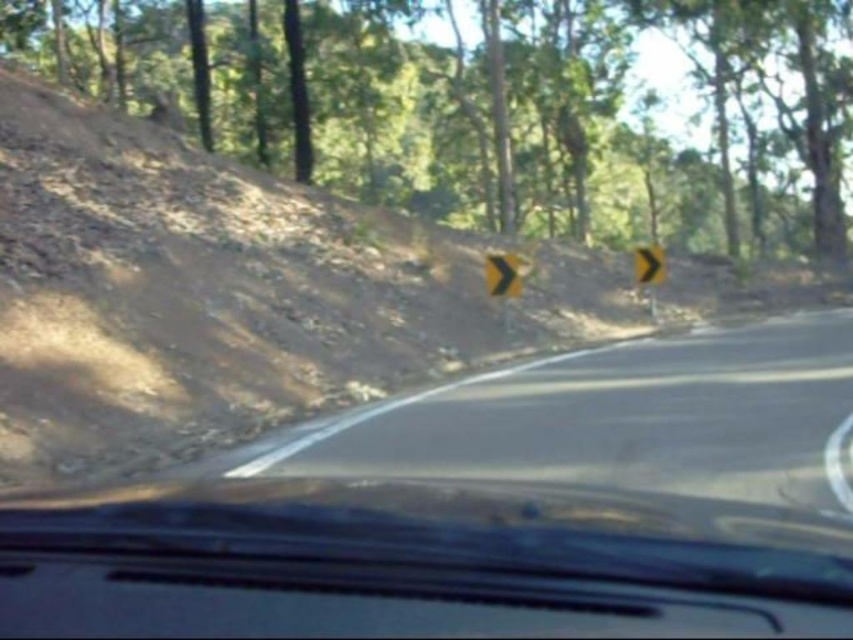
Question: Which of the following is the closest to the observer?

Choices:
 (A) black asphalt road at center
 (B) transparent plastic windshield at center
 (C) yellow matte arrow at center

Answer: (B)

Question: Observing the image, what is the correct spatial positioning of transparent plastic windshield at center in reference to yellow matte arrow at upper right?

Choices:
 (A) left
 (B) right

Answer: (A)

Question: Estimate the real-world distances between objects in this image. Which object is closer to the yellow matte arrow at upper right?

Choices:
 (A) yellow matte arrow at center
 (B) brown dirt hill at upper left
 (C) transparent plastic windshield at center
 (D) black asphalt road at center

Answer: (A)

Question: Which of the following is the closest to the observer?

Choices:
 (A) yellow matte arrow at upper right
 (B) black asphalt road at center
 (C) brown dirt hill at upper left
 (D) yellow matte arrow at center

Answer: (B)

Question: Is black asphalt road at center positioned at the back of yellow matte arrow at upper right?

Choices:
 (A) no
 (B) yes

Answer: (A)

Question: Can you confirm if black asphalt road at center is positioned below yellow matte arrow at upper right?

Choices:
 (A) yes
 (B) no

Answer: (A)